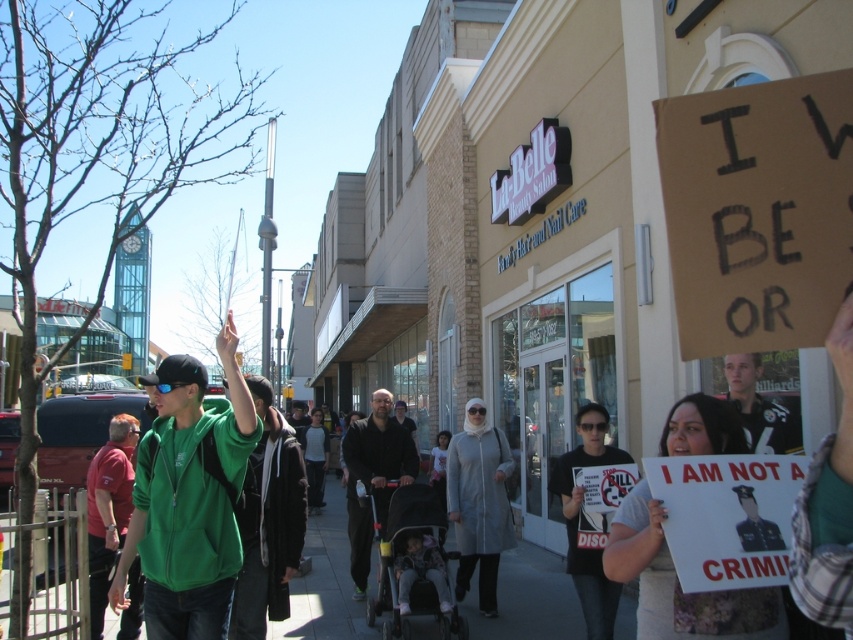
How much distance is there between dark gray fabric stroller at center and white leather jacket at center?

dark gray fabric stroller at center is 3.90 meters from white leather jacket at center.

Is point (399, 474) positioned in front of point (728, 385)?

That is False.

You are a GUI agent. You are given a task and a screenshot of the screen. Output one action in this format:
    pyautogui.click(x=<x>, y=<y>)
    Task: Click on the dark gray fabric stroller at center
    The image size is (853, 640).
    Given the screenshot: What is the action you would take?
    pyautogui.click(x=373, y=476)

Locate an element on the screen. dark gray fabric stroller at center is located at coordinates (373, 476).

Looking at this image, which is below, red shirt at left or dark gray fabric stroller at center?

Positioned lower is red shirt at left.

Where is `red shirt at left`? The height and width of the screenshot is (640, 853). red shirt at left is located at coordinates (108, 508).

You are a GUI agent. You are given a task and a screenshot of the screen. Output one action in this format:
    pyautogui.click(x=<x>, y=<y>)
    Task: Click on the red shirt at left
    This screenshot has width=853, height=640.
    Given the screenshot: What is the action you would take?
    pyautogui.click(x=108, y=508)

Which is more to the left, green zip-up hoodie at center or red shirt at left?

red shirt at left

Does green zip-up hoodie at center have a greater width compared to red shirt at left?

Correct, the width of green zip-up hoodie at center exceeds that of red shirt at left.

The image size is (853, 640). Identify the location of green zip-up hoodie at center. (189, 500).

Image resolution: width=853 pixels, height=640 pixels. I want to click on green zip-up hoodie at center, so click(x=189, y=500).